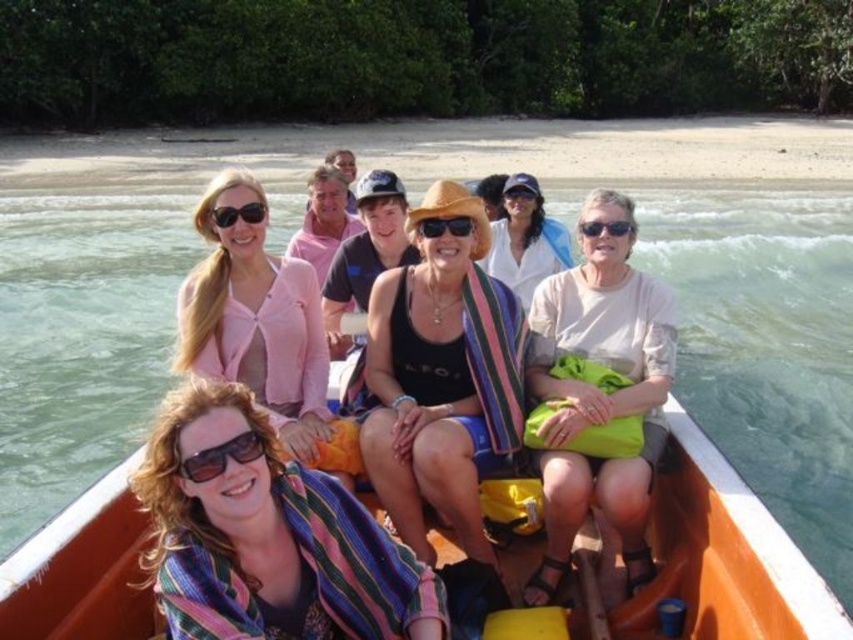
Does pink fabric jacket at upper left have a greater height compared to matte black sunglasses at upper left?

Correct, pink fabric jacket at upper left is much taller as matte black sunglasses at upper left.

Between point (236, 262) and point (253, 212), which one is positioned behind?

The point (236, 262) is more distant.

Between point (260, 381) and point (258, 216), which one is positioned in front?

Point (260, 381) is more forward.

Where is `pink fabric jacket at upper left`? This screenshot has width=853, height=640. pink fabric jacket at upper left is located at coordinates (262, 332).

Who is positioned more to the left, pink fabric jacket at upper left or sunglasses at center?

pink fabric jacket at upper left

Who is positioned more to the right, pink fabric jacket at upper left or sunglasses at center?

sunglasses at center

I want to click on pink fabric jacket at upper left, so click(x=262, y=332).

Image resolution: width=853 pixels, height=640 pixels. Identify the location of pink fabric jacket at upper left. (262, 332).

Who is more forward, (x=199, y=564) or (x=604, y=298)?

Point (x=199, y=564)

Where is `striped scarf at center`? This screenshot has width=853, height=640. striped scarf at center is located at coordinates (265, 536).

Locate an element on the screen. Image resolution: width=853 pixels, height=640 pixels. striped scarf at center is located at coordinates (265, 536).

Where is `striped scarf at center`? striped scarf at center is located at coordinates (265, 536).